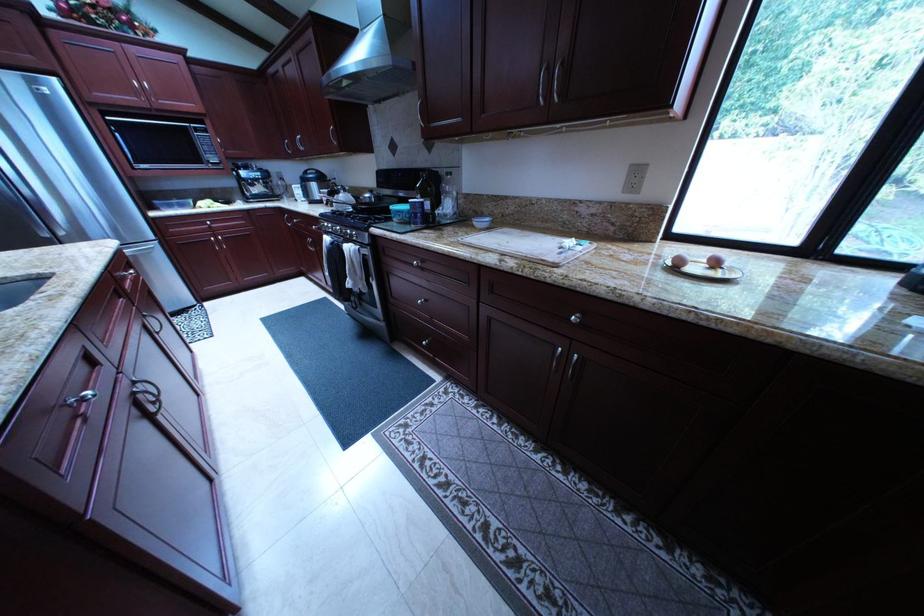
What are the coordinates of `silver drawer knob` in the screenshot? It's located at 416,262.